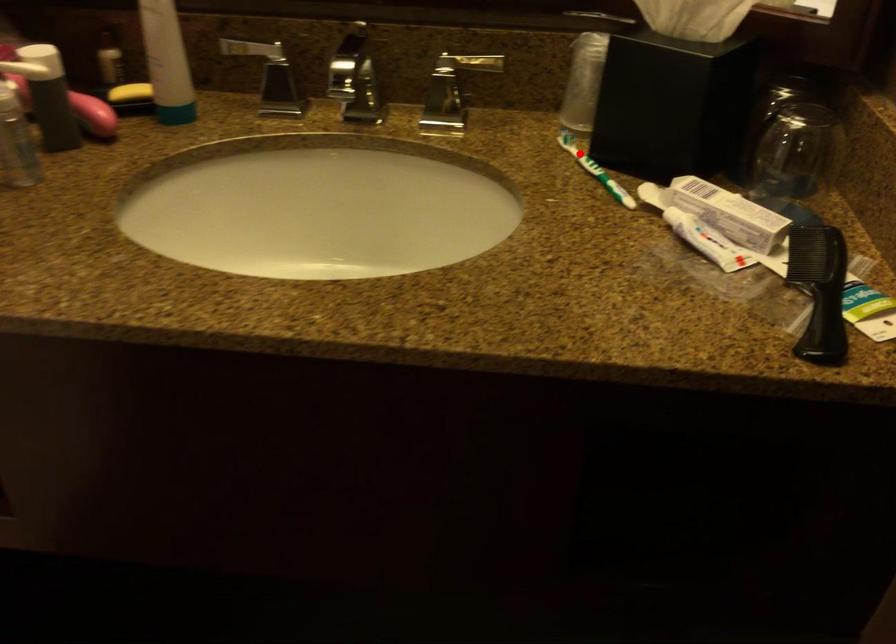
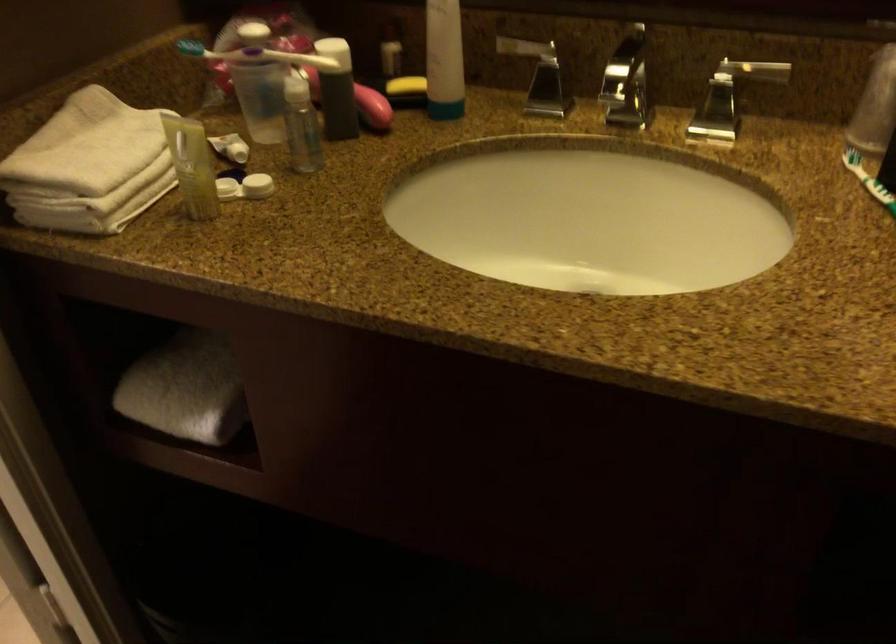
Question: I am providing you with two images of the same scene from different viewpoints. Given a red point in image1, look at the same physical point in image2. Is it:

Choices:
 (A) Closer to the viewpoint
 (B) Farther from the viewpoint

Answer: (A)